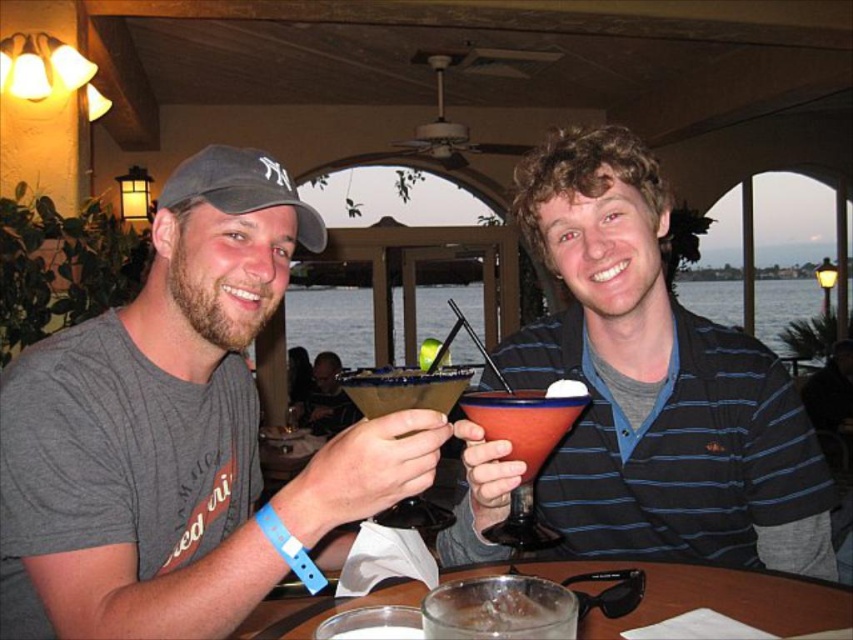
Question: Which point appears farthest from the camera in this image?

Choices:
 (A) (207, 147)
 (B) (358, 413)
 (C) (212, 576)
 (D) (693, 609)

Answer: (B)

Question: Which is farther from the clear glass ice at center?

Choices:
 (A) clear glass at center
 (B) dark brown glass at center
 (C) matte red glass at right
 (D) matte gray t-shirt at center

Answer: (D)

Question: Is matte gray t-shirt at center above dark brown glass at center?

Choices:
 (A) yes
 (B) no

Answer: (A)

Question: Does matte gray t-shirt at center have a smaller size compared to dark brown glass at center?

Choices:
 (A) no
 (B) yes

Answer: (A)

Question: Which of the following is the farthest from the observer?

Choices:
 (A) (502, 604)
 (B) (779, 588)
 (C) (229, 381)
 (D) (183, 205)

Answer: (C)

Question: Is clear glass at center smaller than matte red glass at right?

Choices:
 (A) yes
 (B) no

Answer: (B)